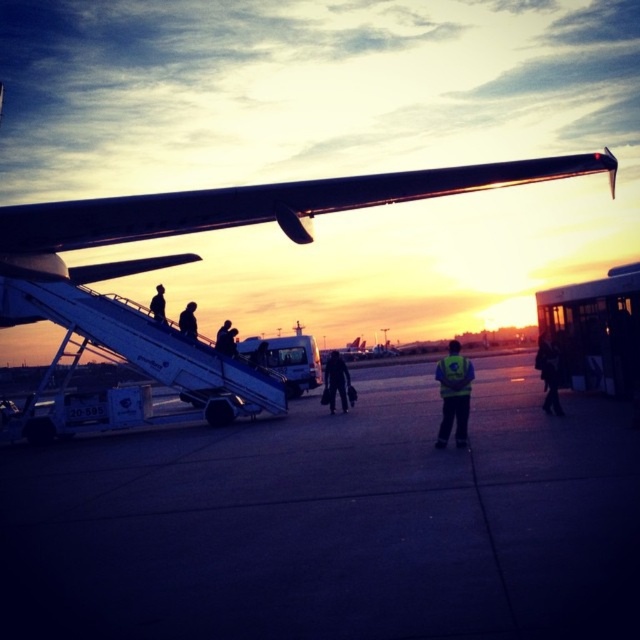
Which is below, metallic silver wing at upper center or dark blue fabric jacket at lower right?

dark blue fabric jacket at lower right

Is metallic silver wing at upper center taller than dark blue fabric jacket at lower right?

Yes.

Is point (77, 310) less distant than point (556, 360)?

No.

The width and height of the screenshot is (640, 640). What are the coordinates of `metallic silver wing at upper center` in the screenshot? It's located at (193, 260).

Can you confirm if dark blue jeans at center is thinner than silhouette figure at center?

Incorrect, dark blue jeans at center's width is not less than silhouette figure at center's.

Is dark blue jeans at center shorter than silhouette figure at center?

No, dark blue jeans at center is not shorter than silhouette figure at center.

Does point (330, 364) come in front of point (161, 305)?

No, (330, 364) is behind (161, 305).

What are the coordinates of `dark blue jeans at center` in the screenshot? It's located at (337, 380).

How much distance is there between reflective yellow vest at center and dark blue jeans at center?

A distance of 6.57 meters exists between reflective yellow vest at center and dark blue jeans at center.

Which is in front, point (460, 344) or point (332, 362)?

Point (460, 344)

Which is in front, point (436, 364) or point (337, 360)?

Point (436, 364) is more forward.

The image size is (640, 640). What are the coordinates of `reflective yellow vest at center` in the screenshot? It's located at (452, 394).